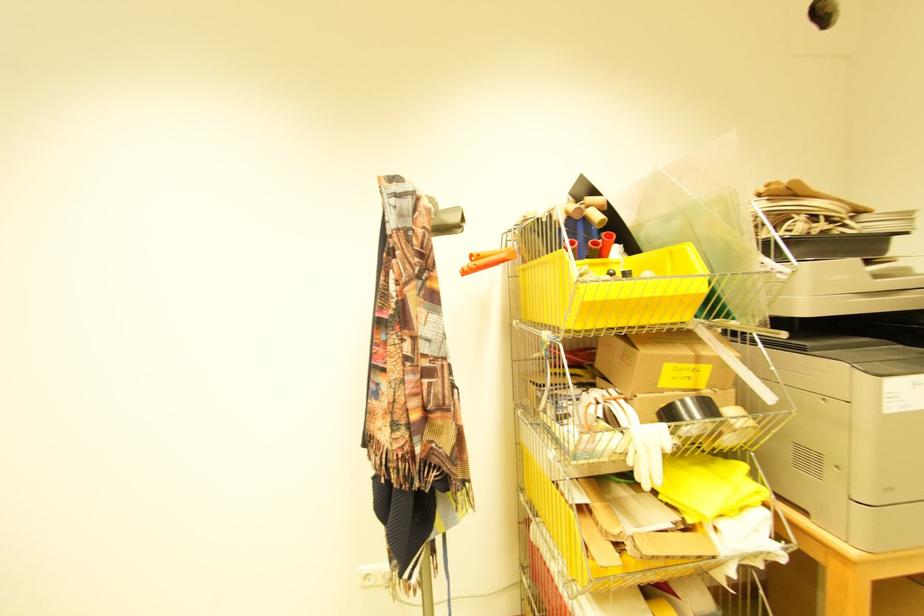
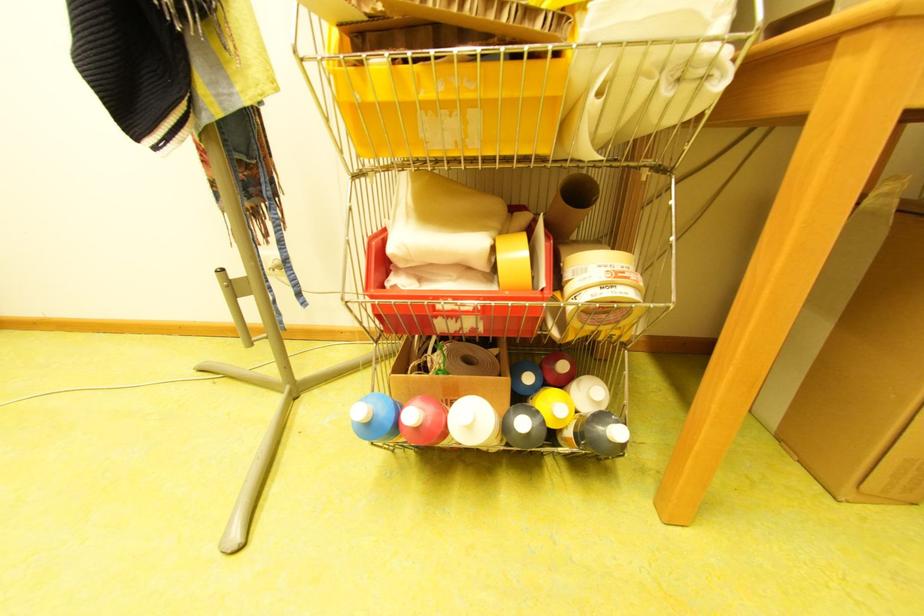
Question: The first image is from the beginning of the video and the second image is from the end. How did the camera likely rotate when shooting the video?

Choices:
 (A) Left
 (B) Right
 (C) Up
 (D) Down

Answer: (D)